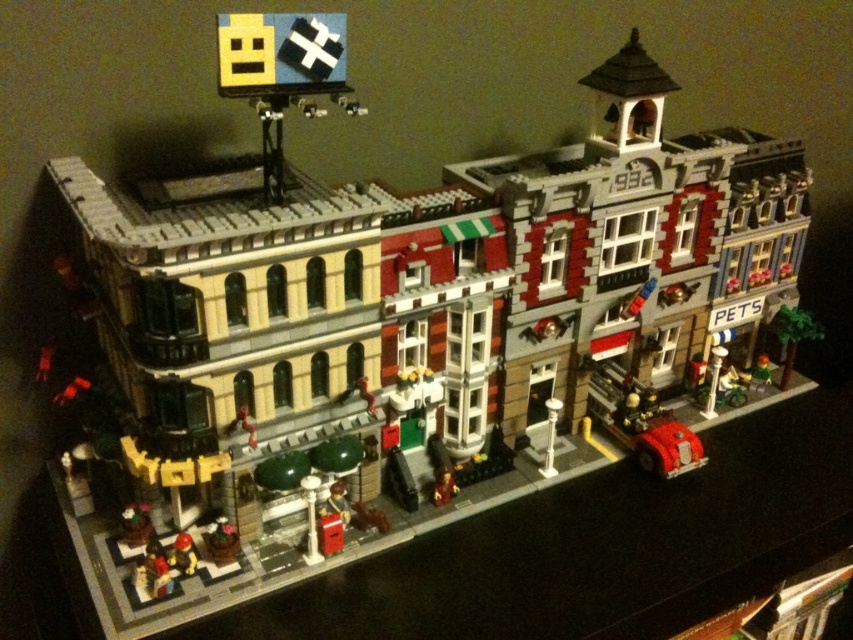
Question: Can you confirm if brick-like figure at lower left is thinner than metallic gold toy at center?

Choices:
 (A) yes
 (B) no

Answer: (B)

Question: Which point is closer to the camera?

Choices:
 (A) brick-like figure at lower left
 (B) metallic gold toy at center

Answer: (A)

Question: Which object appears farthest from the camera in this image?

Choices:
 (A) brick-like figure at lower left
 (B) metallic gold toy at center

Answer: (B)

Question: Does brick-like figure at lower left appear on the right side of metallic gold toy at center?

Choices:
 (A) no
 (B) yes

Answer: (A)

Question: Is brick-like figure at lower left positioned before metallic gold toy at center?

Choices:
 (A) yes
 (B) no

Answer: (A)